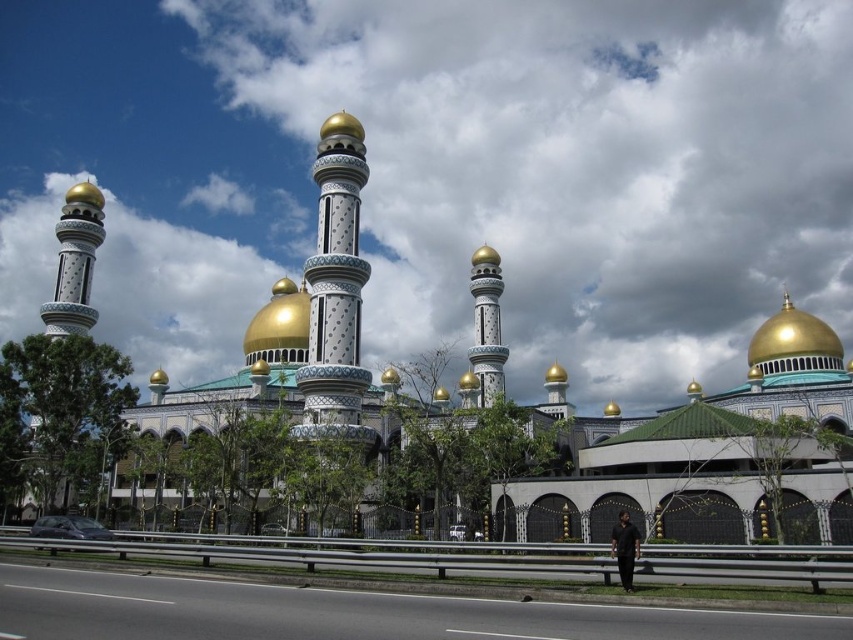
You are a tourist standing on the sidewalk near the road. You want to take a photo of the gold metallic dome at upper center and the gold polished tower at center. Which object should you point your camera towards first if you want to capture both in one shot?

The gold metallic dome at upper center is below the gold polished tower at center, so you should point your camera towards the gold polished tower at center first to ensure both objects are in the frame.

You are a drone operator tasked with capturing aerial footage of the mosque. Your drone has a maximum flight range of 40 meters from its starting position. If you position your drone at the gold polished tower at center, can it reach the gold metallic dome at upper center without exceeding its range?

The distance between the gold metallic dome at upper center and the gold polished tower at center is 39.62 meters, which is within the drone operator s 40 meters range. Therefore, the drone can reach the gold metallic dome at upper center without exceeding its range.